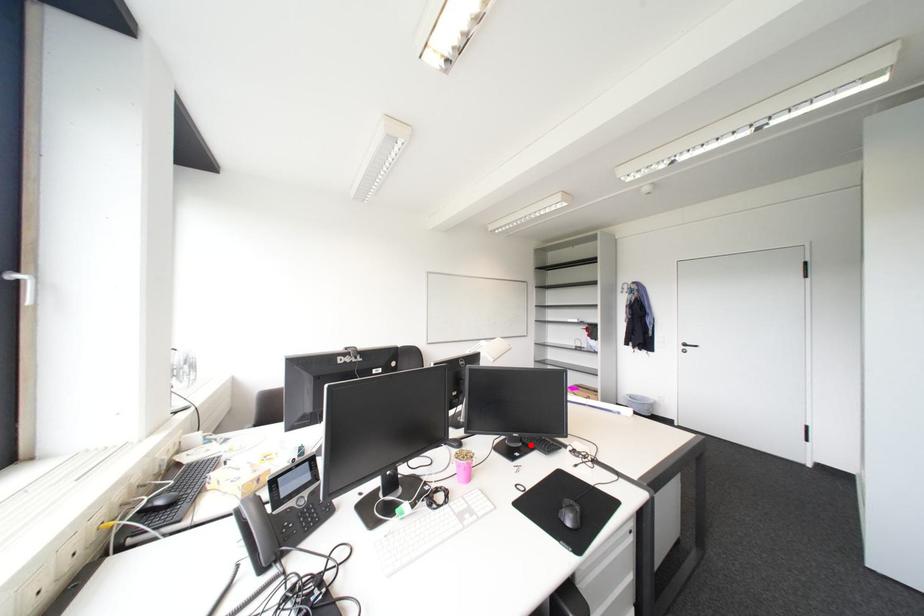
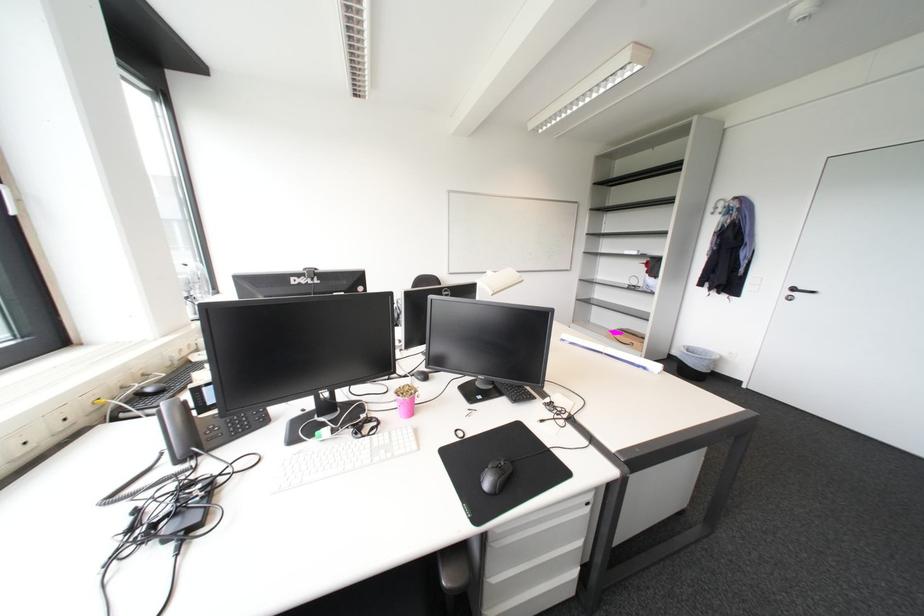
The point at the highlighted location is marked in the first image. Where is the corresponding point in the second image?

(502, 387)